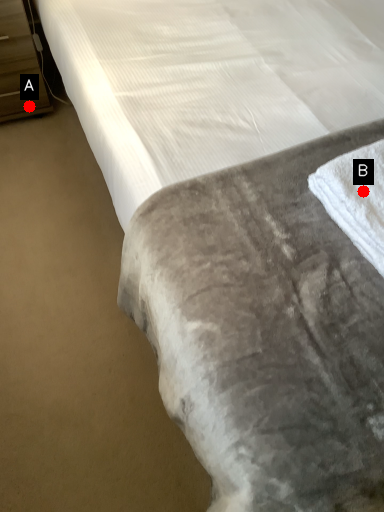
Question: Two points are circled on the image, labeled by A and B beside each circle. Which point appears closest to the camera in this image?

Choices:
 (A) A is closer
 (B) B is closer

Answer: (B)